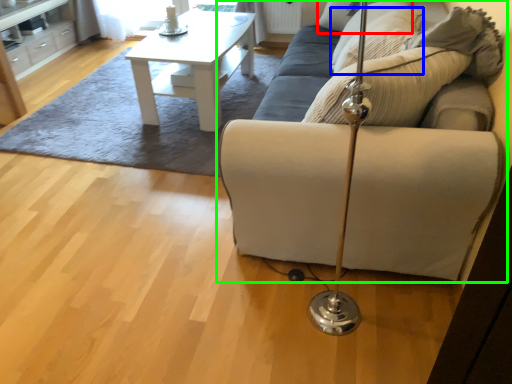
Question: Considering the real-world distances, which object is closest to pillow (highlighted by a red box)? pillow (highlighted by a blue box) or studio couch (highlighted by a green box).

Choices:
 (A) pillow
 (B) studio couch

Answer: (A)